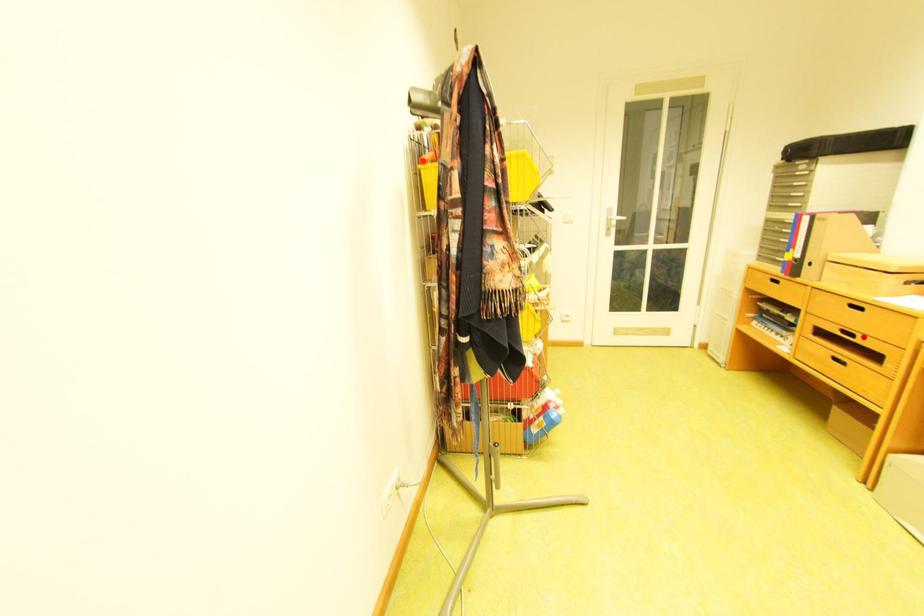
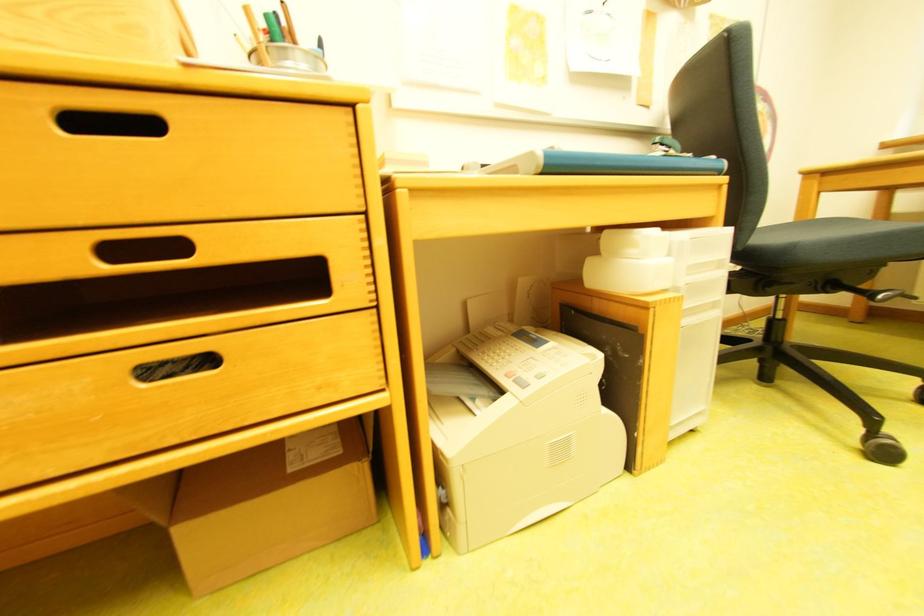
Locate, in the second image, the point that corresponds to the highlighted location in the first image.

(189, 246)